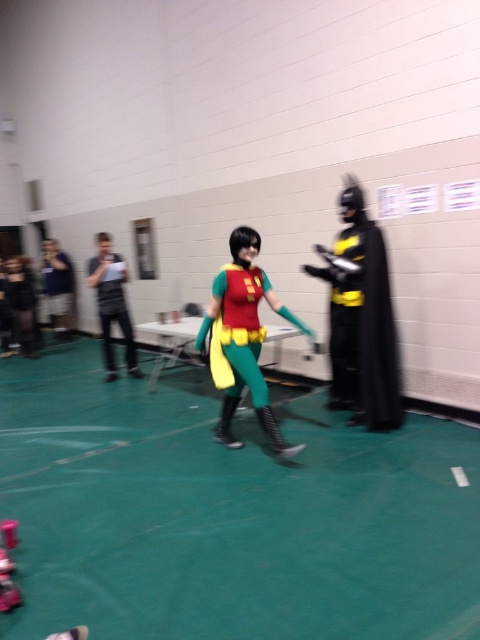
You are a photographer at the event and need to capture a photo of the black matte batman costume at right. Your camera has a minimum focus distance of 4 meters. Will you be able to take a clear photo without moving the camera or the costume?

The black matte batman costume at right and the camera are 3.81 meters apart. Since the minimum focus distance is 4 meters, the camera cannot focus clearly at 3.81 meters. You need to move either the camera or the costume to increase the distance to at least 4 meters.

You are organizing a photo shoot in the convention gymnasium. You have a matte green costume at center and a matte black camera at left. If you want to ensure both items are visible in a single shot without moving the camera, which item requires more horizontal space in the frame?

The matte green costume at center requires more horizontal space in the frame because its width surpasses that of the matte black camera at left.

You are organizing a photo shoot in the gymnasium and need to position a camera to capture the matte green costume at center. Based on the scene description, where should you aim the camera to ensure the costume is in the frame?

The matte green costume at center is located at point (x=242, y=339), so you should aim the camera at those coordinates to ensure the costume is centered in the frame.